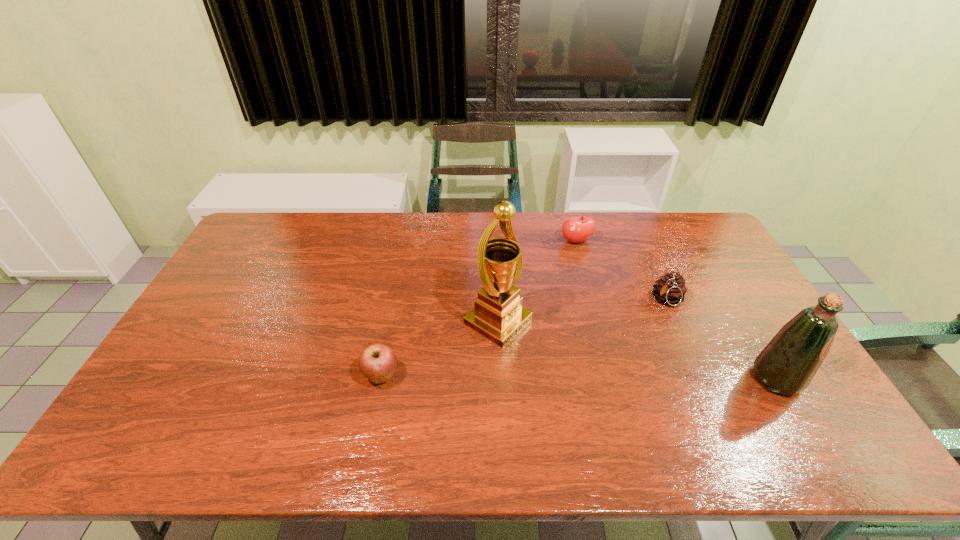
Find the location of `vacant spot on the desktop that is between the nearer apple and the rightmost object and is positioned with a leaf charm attached to the pinecone`. vacant spot on the desktop that is between the nearer apple and the rightmost object and is positioned with a leaf charm attached to the pinecone is located at coordinates (609, 377).

At what (x,y) coordinates should I click in order to perform the action: click on vacant space on the desktop that is between the leftmost object and the second tallest object and is positioned on the stem of the third object from left to right. Please return your answer as a coordinate pair (x, y). Looking at the image, I should click on (615, 377).

Image resolution: width=960 pixels, height=540 pixels. I want to click on free spot on the desktop that is between the nearer apple and the fourth shortest object and is positioned on the front-facing side of the tallest object, so click(x=590, y=377).